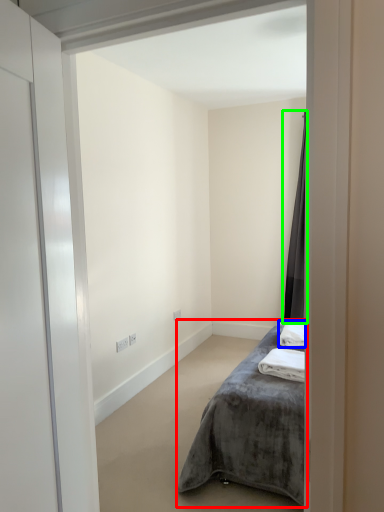
Question: Which object is the farthest from bed (highlighted by a red box)? Choose among these: bath towel (highlighted by a blue box) or curtain (highlighted by a green box).

Choices:
 (A) bath towel
 (B) curtain

Answer: (B)